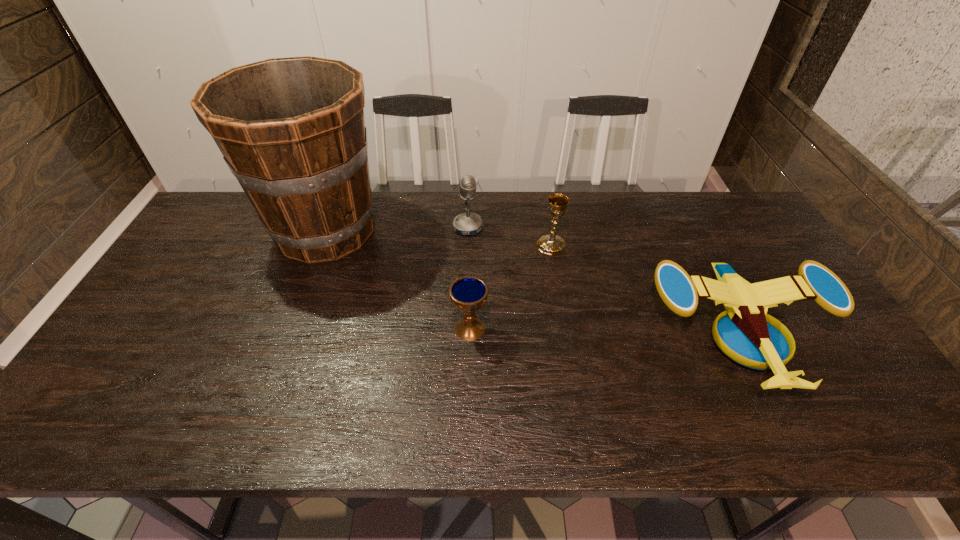
Identify the location of vacant space that is in between the rightmost object and the fourth object from left to right. This screenshot has height=540, width=960. (645, 289).

Find the location of `object that is the second closest to the farther chalice`. object that is the second closest to the farther chalice is located at coordinates (749, 336).

In order to click on object identified as the third closest to the left chalice in this screenshot , I will do `click(468, 223)`.

Image resolution: width=960 pixels, height=540 pixels. In order to click on vacant space that satisfies the following two spatial constraints: 1. on the back side of the fourth object from left to right; 2. on the front-facing side of the microphone in this screenshot , I will do `click(548, 227)`.

In order to click on vacant position in the image that satisfies the following two spatial constraints: 1. on the back side of the second object from right to left; 2. on the left side of the left chalice in this screenshot , I will do `click(471, 245)`.

Where is `vacant point that satisfies the following two spatial constraints: 1. on the front-facing side of the microphone; 2. on the left side of the left chalice`? The image size is (960, 540). vacant point that satisfies the following two spatial constraints: 1. on the front-facing side of the microphone; 2. on the left side of the left chalice is located at coordinates (466, 328).

This screenshot has height=540, width=960. What are the coordinates of `free space that satisfies the following two spatial constraints: 1. on the front-facing side of the microphone; 2. on the back side of the fourth object from left to right` in the screenshot? It's located at [x=468, y=245].